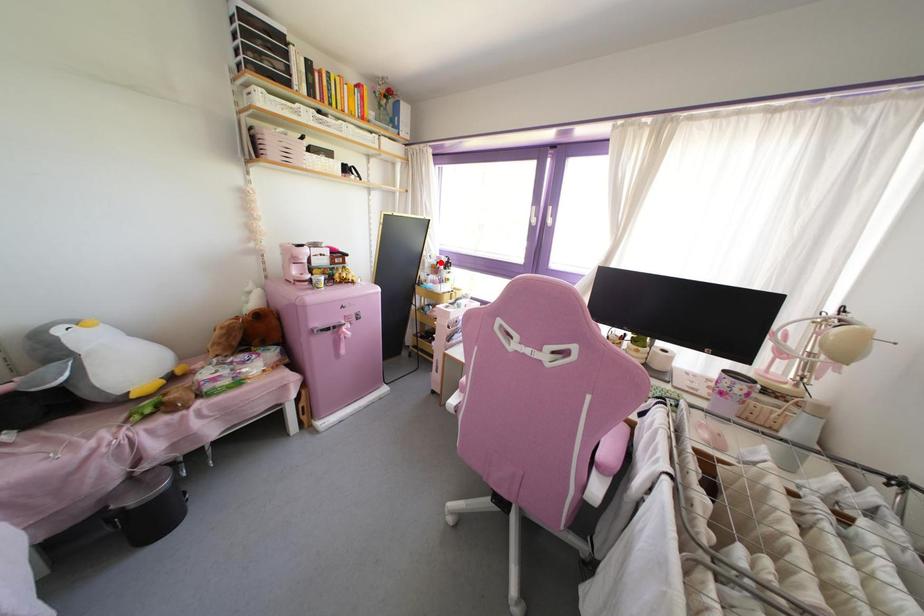
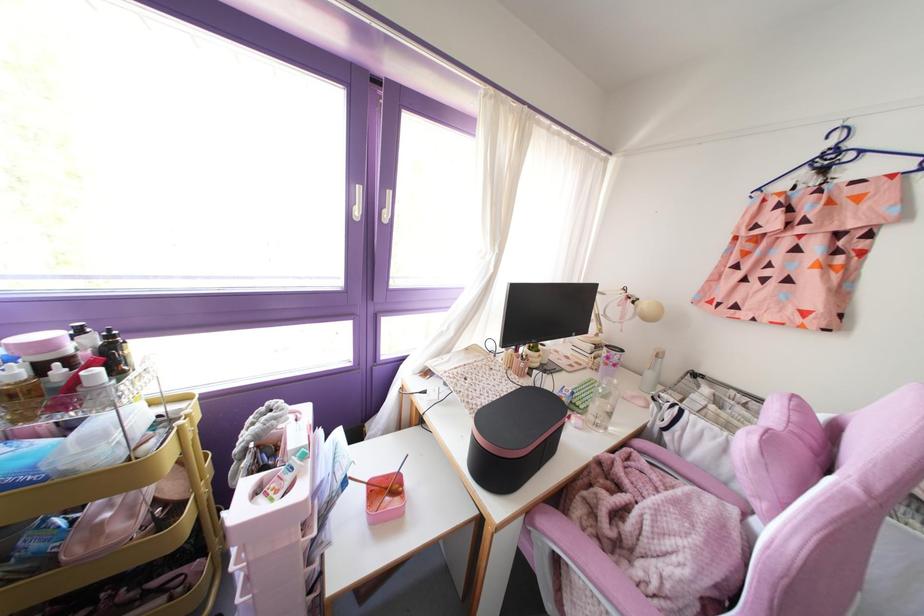
Question: I am providing you with two images of the same scene from different viewpoints. A red point is marked on the first image. Is the red point's position out of view in image 2?

Choices:
 (A) Yes
 (B) No

Answer: (B)